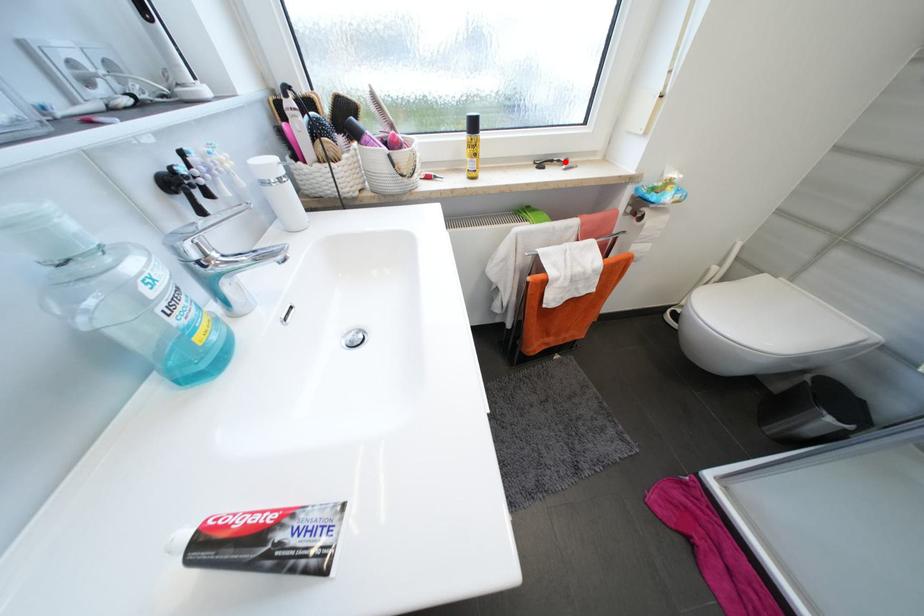
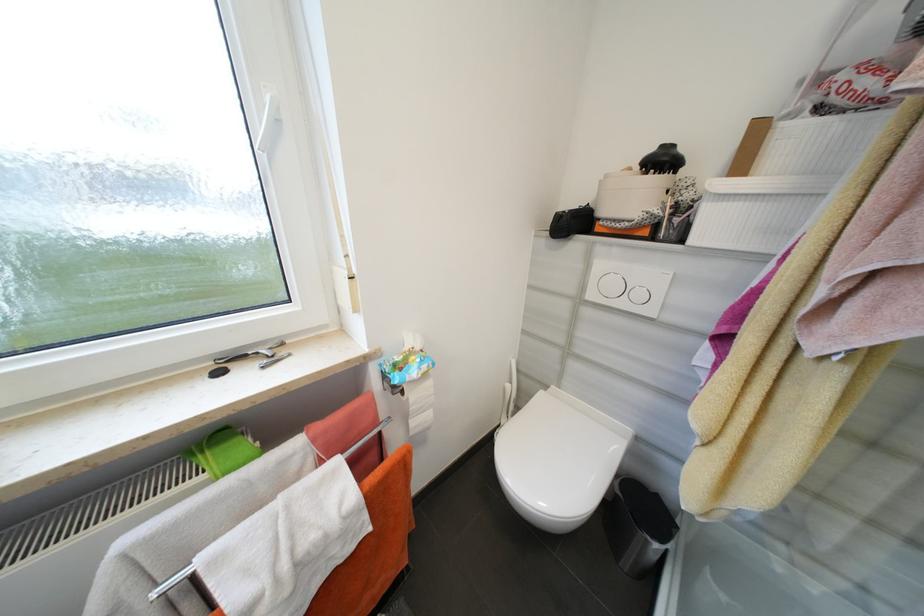
In the second image, find the point that corresponds to the highlighted location in the first image.

(262, 354)